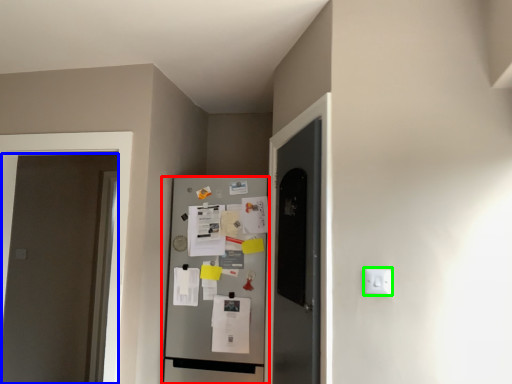
Question: Which is nearer to the refrigerator (highlighted by a red box)? door (highlighted by a blue box) or electric outlet (highlighted by a green box).

Choices:
 (A) door
 (B) electric outlet

Answer: (B)